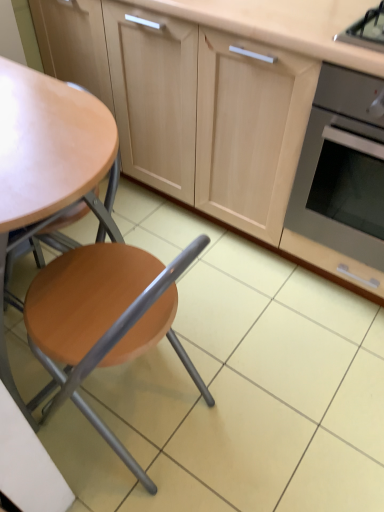
Question: Considering the positions of stainless steel oven at right and matte wood cabinetry at center in the image, is stainless steel oven at right bigger or smaller than matte wood cabinetry at center?

Choices:
 (A) big
 (B) small

Answer: (B)

Question: Is stainless steel oven at right wider or thinner than matte wood cabinetry at center?

Choices:
 (A) thin
 (B) wide

Answer: (B)

Question: Which object is positioned farthest from the matte wood chair at left?

Choices:
 (A) matte wood cabinetry at center
 (B) stainless steel oven at right

Answer: (A)

Question: Considering the real-world distances, which object is closest to the matte wood cabinetry at center?

Choices:
 (A) matte wood chair at left
 (B) stainless steel oven at right

Answer: (B)